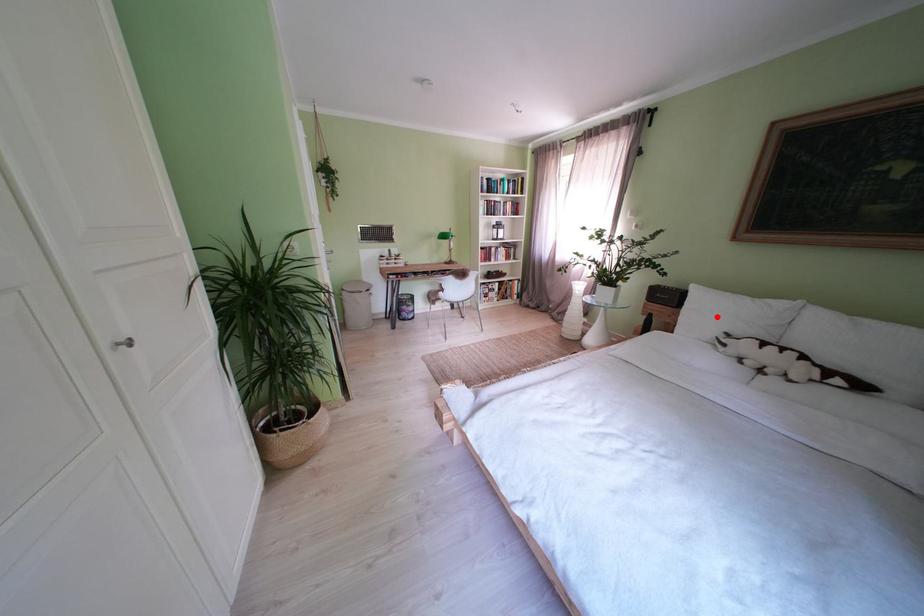
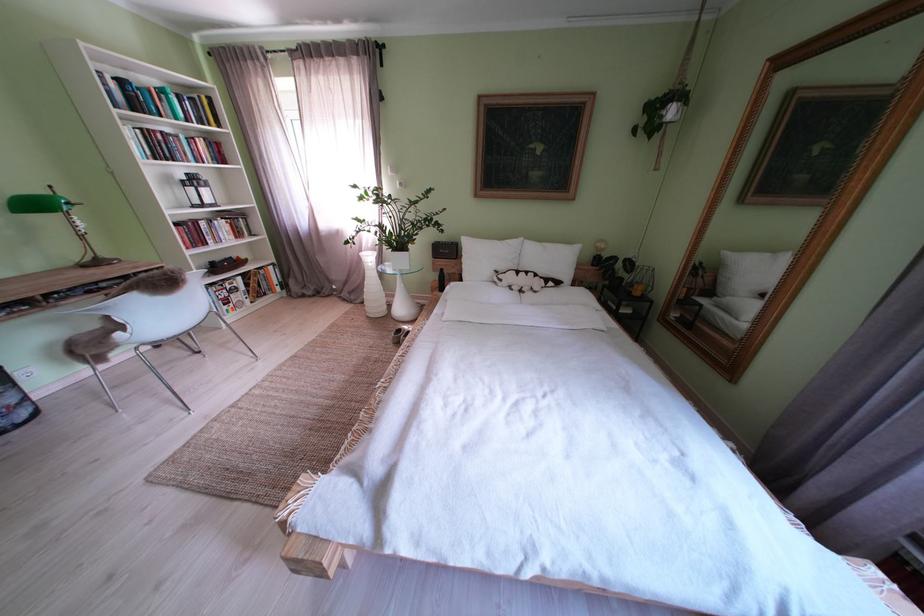
Question: I am providing you with two images of the same scene from different viewpoints. A red point is marked on the first image. Is the red point's position out of view in image 2?

Choices:
 (A) Yes
 (B) No

Answer: (B)